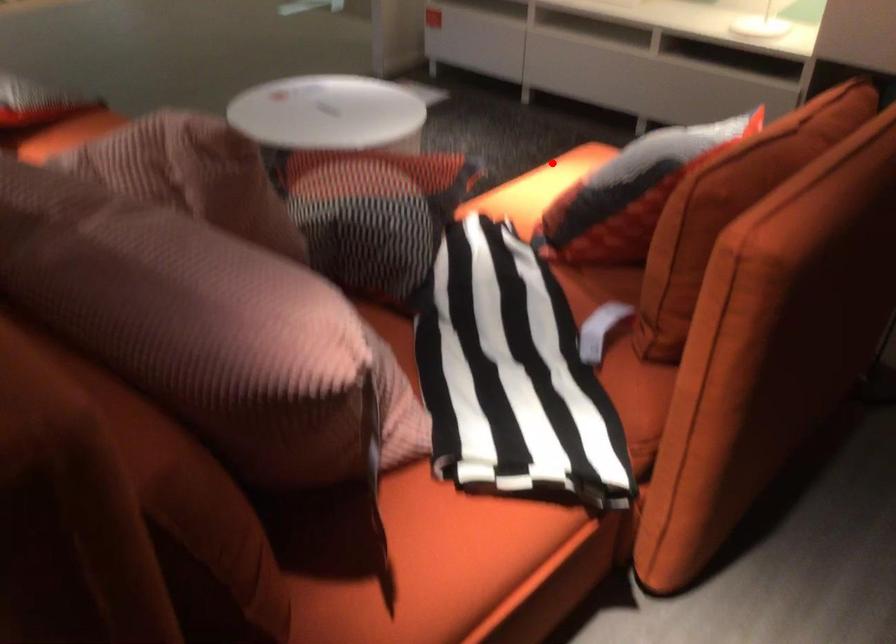
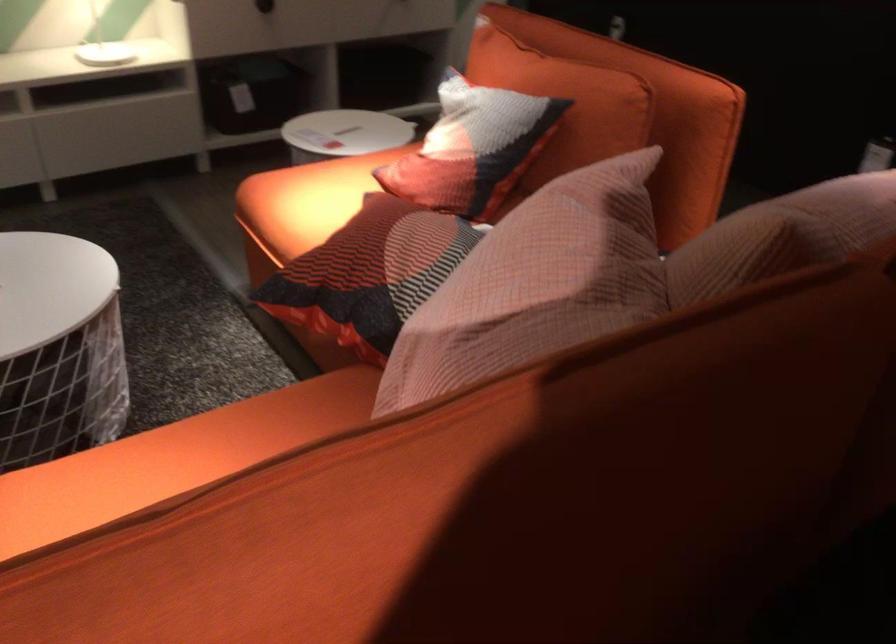
In the second image, find the point that corresponds to the highlighted location in the first image.

(306, 200)